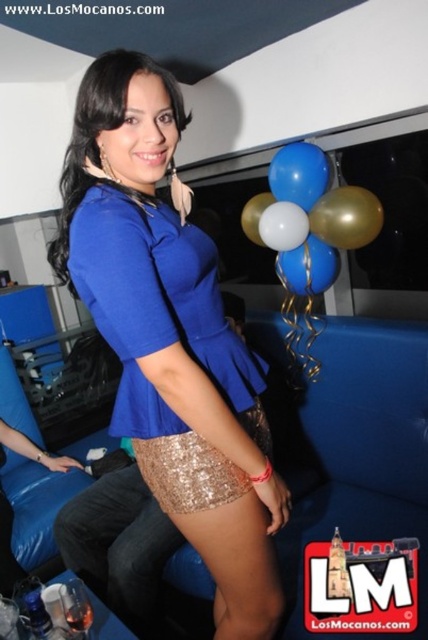
You are a photographer at the party and want to capture a photo that includes both the sequin fabric skirt at lower center and the blue glossy balloons at upper center. Which object should you position closer to the left side of the frame to ensure both are visible?

The sequin fabric skirt at lower center should be positioned closer to the left side of the frame since it is already on the left side of the blue glossy balloons at upper center.